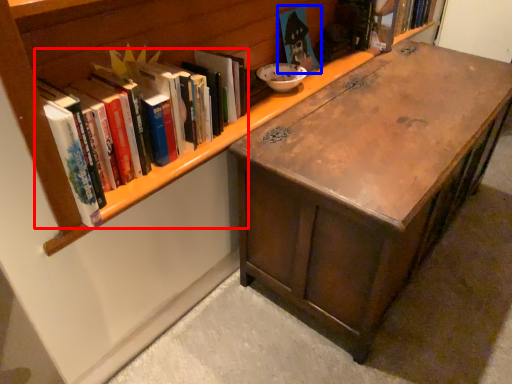
Question: Which of the following is the farthest to the observer, book (highlighted by a red box) or book (highlighted by a blue box)?

Choices:
 (A) book
 (B) book

Answer: (B)